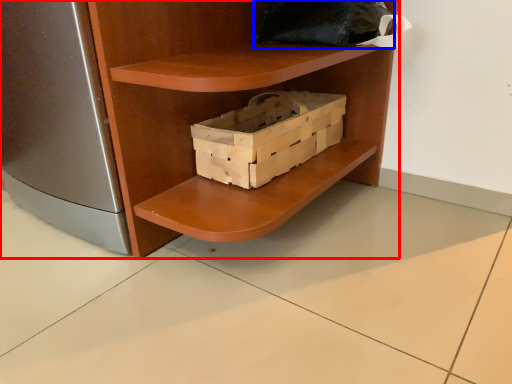
Question: Which object appears farthest to the camera in this image, shelf (highlighted by a red box) or pillow (highlighted by a blue box)?

Choices:
 (A) shelf
 (B) pillow

Answer: (B)